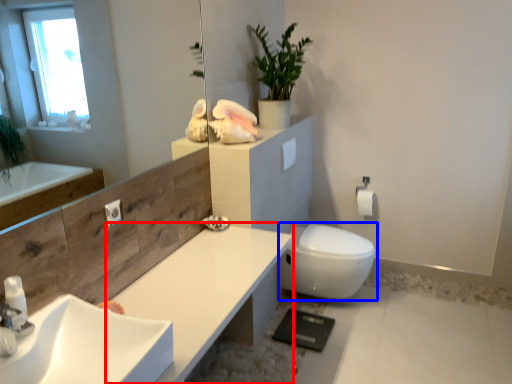
Question: Which of the following is the closest to the observer, counter top (highlighted by a red box) or bidet (highlighted by a blue box)?

Choices:
 (A) counter top
 (B) bidet

Answer: (A)